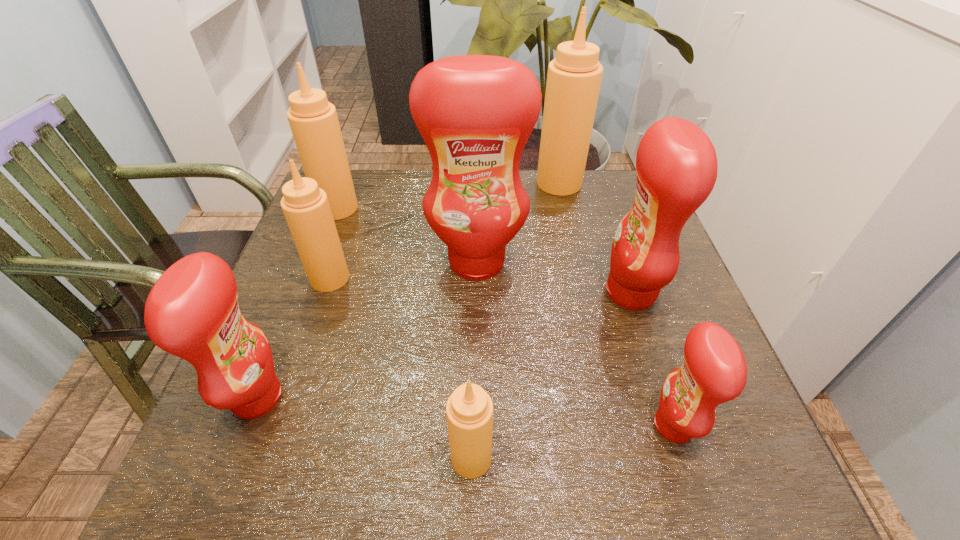
In order to click on free spot at the right edge of the desktop in this screenshot , I will do `click(666, 368)`.

In the image, there is a desktop. Where is `vacant space at the far right corner`? vacant space at the far right corner is located at coordinates (627, 198).

This screenshot has height=540, width=960. In the image, there is a desktop. Find the location of `free space at the near right corner`. free space at the near right corner is located at coordinates pyautogui.click(x=758, y=493).

Where is `free space between the second biggest tan condiment and the second smallest red condiment`? This screenshot has width=960, height=540. free space between the second biggest tan condiment and the second smallest red condiment is located at coordinates (298, 303).

Find the location of `vacant space that's between the second farthest condiment and the biggest red condiment`. vacant space that's between the second farthest condiment and the biggest red condiment is located at coordinates coord(407,235).

At what (x,y) coordinates should I click in order to perform the action: click on unoccupied area between the second biggest red condiment and the third biggest tan condiment. Please return your answer as a coordinate pair (x, y). Image resolution: width=960 pixels, height=540 pixels. Looking at the image, I should click on (480, 286).

Find the location of a particular element. This screenshot has height=540, width=960. free space between the third smallest red condiment and the smallest red condiment is located at coordinates (652, 359).

The height and width of the screenshot is (540, 960). Find the location of `blank region between the smallest tan condiment and the second biggest red condiment`. blank region between the smallest tan condiment and the second biggest red condiment is located at coordinates (551, 375).

In order to click on vacant area that lies between the smallest red condiment and the nearest tan condiment in this screenshot , I will do `click(572, 442)`.

The height and width of the screenshot is (540, 960). I want to click on free space between the third red condiment from right to left and the third nearest tan condiment, so click(x=407, y=235).